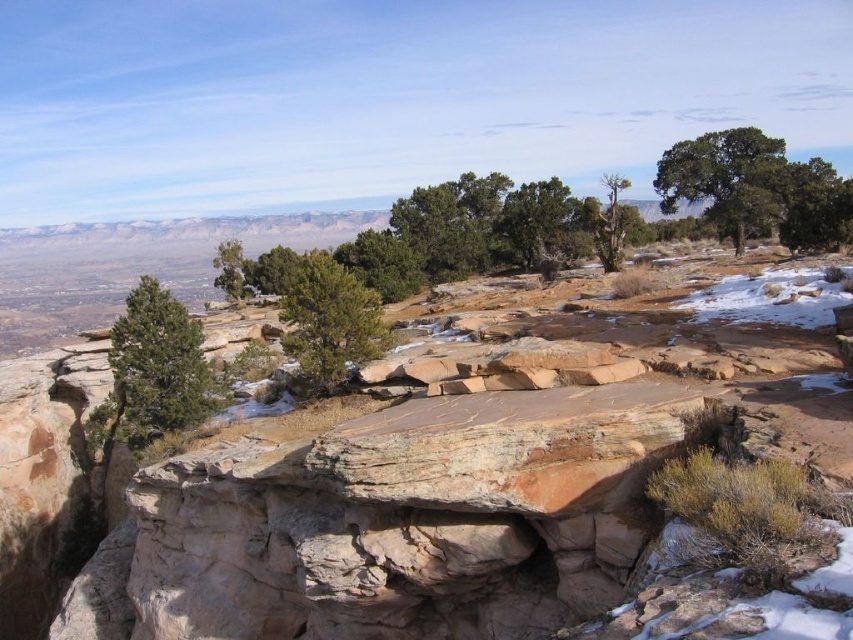
Question: Which point is farther from the camera taking this photo?

Choices:
 (A) (360, 508)
 (B) (751, 198)
 (C) (235, 250)

Answer: (C)

Question: Which is farther from the green leafy tree at upper right?

Choices:
 (A) brown rock formation at center
 (B) green matte tree at left

Answer: (B)

Question: Can you confirm if green leafy tree at upper right is positioned below green leafy tree at upper center?

Choices:
 (A) no
 (B) yes

Answer: (B)

Question: Is green leafy tree at upper right above green matte tree at center?

Choices:
 (A) no
 (B) yes

Answer: (B)

Question: Is green matte tree at left positioned at the back of green matte tree at center?

Choices:
 (A) yes
 (B) no

Answer: (A)

Question: Which object appears farthest from the camera in this image?

Choices:
 (A) green matte tree at left
 (B) green leafy tree at center-left
 (C) green leafy tree at upper center

Answer: (B)